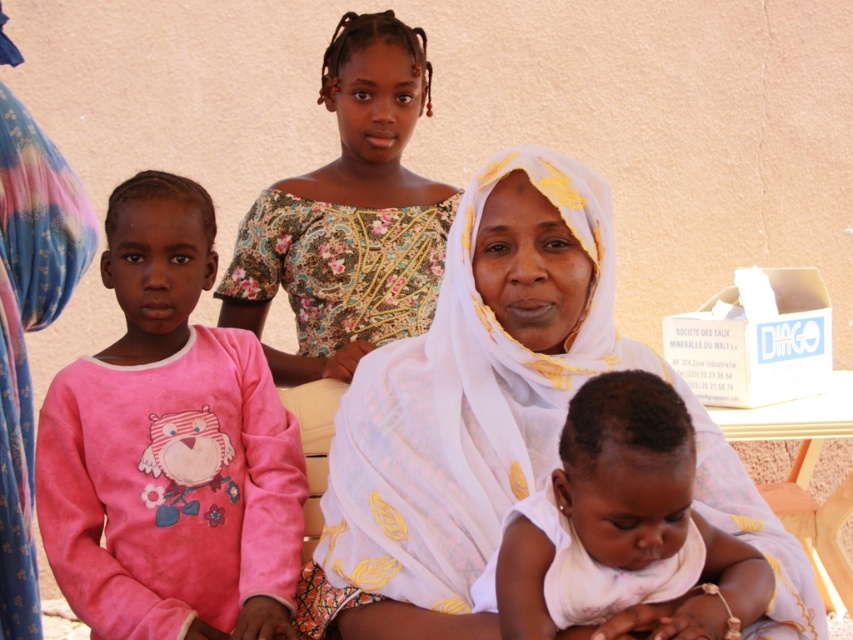
You are a photographer who wants to ensure that both the pink fleece sweater at left and the floral fabric dress at upper center are clearly visible in the photo. Which object should you focus on first to ensure both are in frame?

The photographer should focus on the floral fabric dress at upper center first because it is positioned above the pink fleece sweater at left, ensuring both are in frame when starting from the top.

You are standing in front of the beige wall where the family is seated. You notice the white sheer cloth at center. Can you determine its exact position relative to the other objects in the scene?

The white sheer cloth at center is located at point [471,397].

In the scene, there are a pink fleece sweater at left and a floral fabric dress at upper center. Which one is bigger in size?

The pink fleece sweater at left is smaller in size compared to the floral fabric dress at upper center.